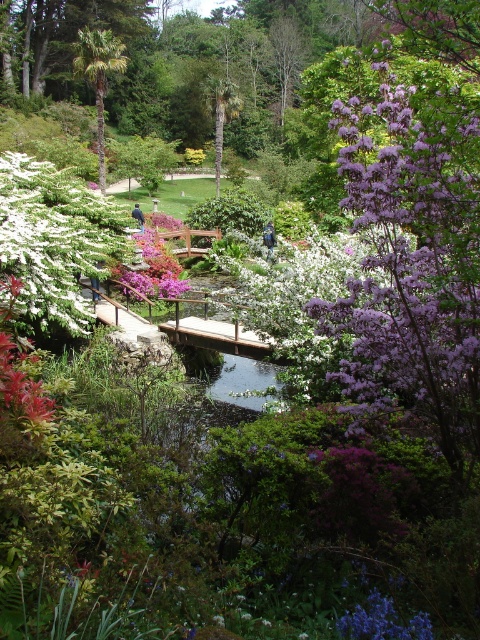
Is purple matte flower at lower center thinner than green leafy bush at center?

Incorrect, purple matte flower at lower center's width is not less than green leafy bush at center's.

What do you see at coordinates (383, 621) in the screenshot?
I see `purple matte flower at lower center` at bounding box center [383, 621].

Identify the location of purple matte flower at lower center. (383, 621).

Is point (203, 220) more distant than point (158, 292)?

Yes, point (203, 220) is farther from viewer.

Does green leafy bush at center have a lesser height compared to pink matte flower at center?

No.

Which is in front, point (220, 196) or point (123, 278)?

Point (123, 278)

Where is `green leafy bush at center`? The image size is (480, 640). green leafy bush at center is located at coordinates (229, 212).

From the picture: How distant is wooden bridge at center from pink matte flower at center?

The distance of wooden bridge at center from pink matte flower at center is 19.39 feet.

Can you confirm if wooden bridge at center is smaller than pink matte flower at center?

Incorrect, wooden bridge at center is not smaller in size than pink matte flower at center.

The width and height of the screenshot is (480, 640). What do you see at coordinates (216, 336) in the screenshot?
I see `wooden bridge at center` at bounding box center [216, 336].

What are the coordinates of `wooden bridge at center` in the screenshot? It's located at (216, 336).